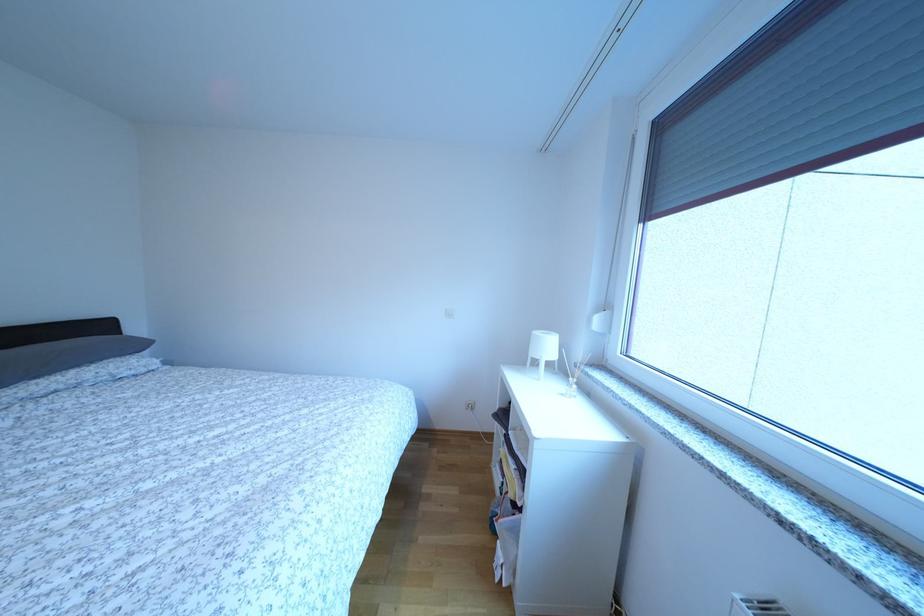
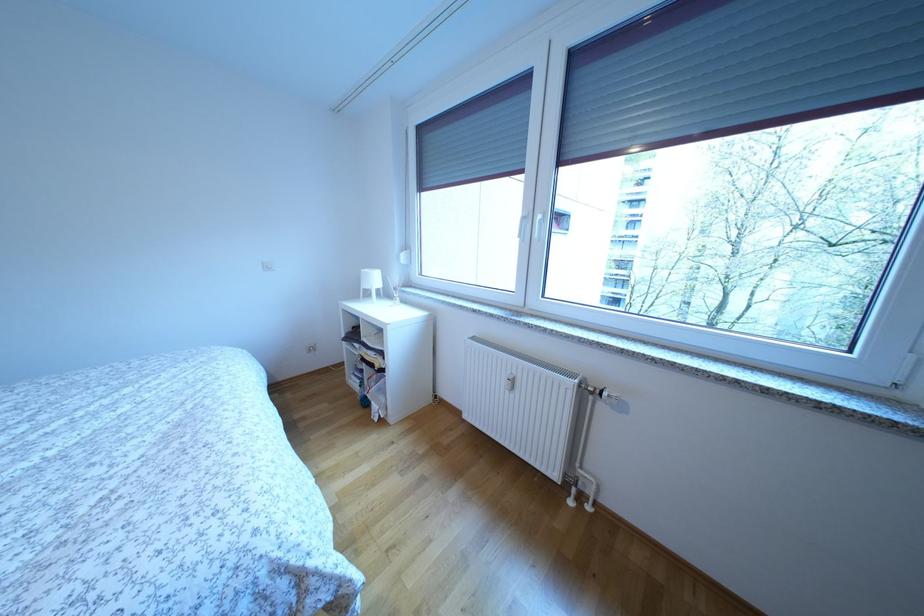
In the second image, find the point that corresponds to point 554,353 in the first image.

(382, 285)